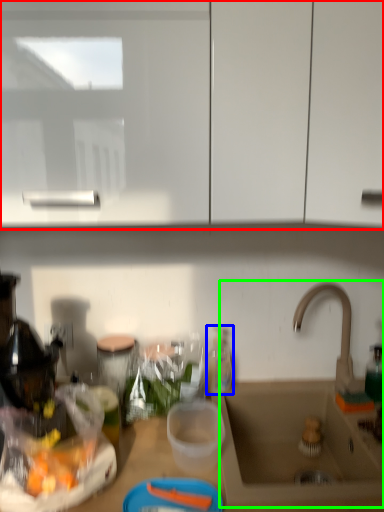
Question: Considering the real-world distances, which object is farthest from cabinetry (highlighted by a red box)? bottle (highlighted by a blue box) or sink (highlighted by a green box)?

Choices:
 (A) bottle
 (B) sink

Answer: (A)